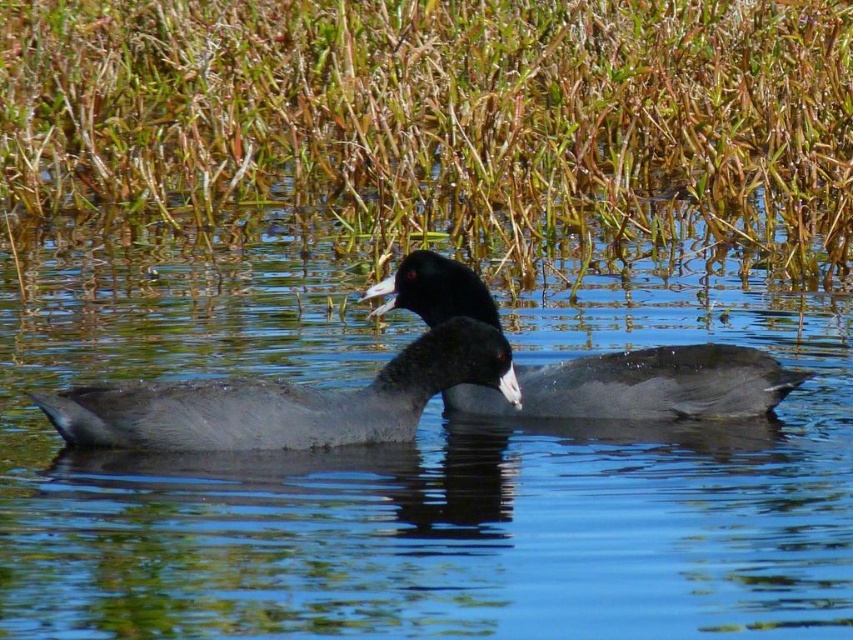
Question: Can you confirm if gray matte duck at center is smaller than green grass at upper center?

Choices:
 (A) yes
 (B) no

Answer: (A)

Question: Which of the following is the farthest from the observer?

Choices:
 (A) green grass at upper center
 (B) matte black duck at center

Answer: (A)

Question: Which of the following is the farthest from the observer?

Choices:
 (A) green grass at upper center
 (B) matte black duck at center
 (C) matte gray duck at center

Answer: (A)

Question: Can you confirm if gray matte duck at center is smaller than matte gray duck at center?

Choices:
 (A) no
 (B) yes

Answer: (A)

Question: Where is green grass at upper center located in relation to matte black duck at center in the image?

Choices:
 (A) left
 (B) right

Answer: (A)

Question: Which of these objects is positioned closest to the gray matte duck at center?

Choices:
 (A) matte black duck at center
 (B) matte gray duck at center
 (C) green grass at upper center

Answer: (B)